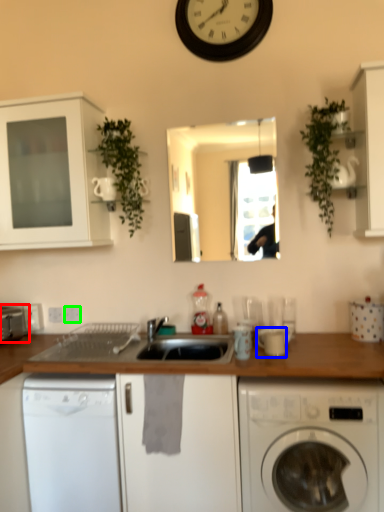
Question: Based on their relative distances, which object is farther from appliance (highlighted by a red box)? Choose from appliance (highlighted by a blue box) and electric outlet (highlighted by a green box).

Choices:
 (A) appliance
 (B) electric outlet

Answer: (A)